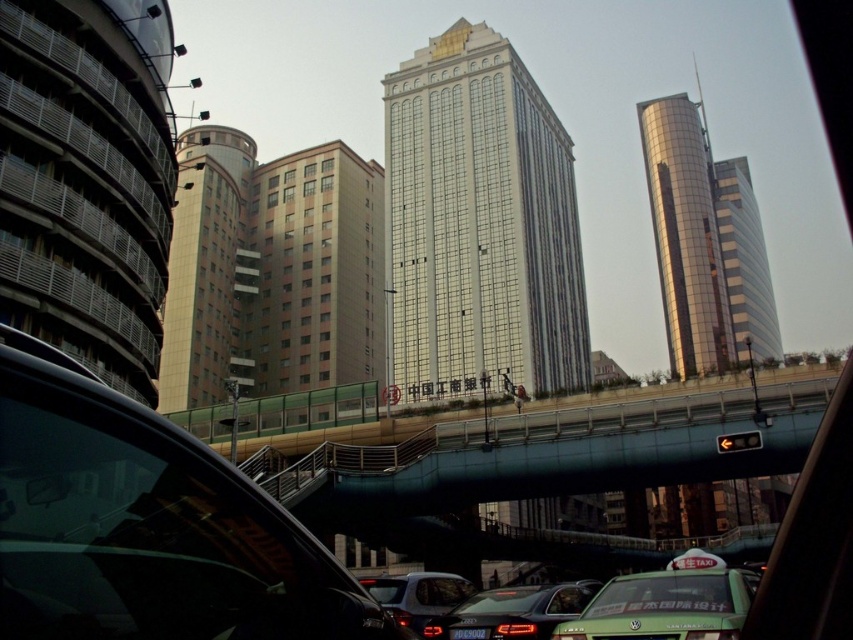
Is matte black car at center further to the viewer compared to matte gray sedan at lower center?

No.

Who is more forward, (463, 625) or (381, 576)?

Point (463, 625) is more forward.

Which is behind, point (442, 628) or point (437, 593)?

Positioned behind is point (437, 593).

I want to click on matte black car at center, so click(x=514, y=611).

Between point (482, 228) and point (364, 193), which one is positioned in front?

Point (482, 228) is more forward.

Does point (509, 196) come behind point (331, 301)?

No.

Which is behind, point (469, 76) or point (351, 304)?

Point (351, 304)

Find the location of a particular element. The image size is (853, 640). white glass building at center is located at coordinates coord(480,225).

Does white glass building at center have a greater height compared to metallic silver building at left?

Correct, white glass building at center is much taller as metallic silver building at left.

This screenshot has width=853, height=640. Describe the element at coordinates (480, 225) in the screenshot. I see `white glass building at center` at that location.

This screenshot has width=853, height=640. What do you see at coordinates (480, 225) in the screenshot?
I see `white glass building at center` at bounding box center [480, 225].

I want to click on white glass building at center, so click(x=480, y=225).